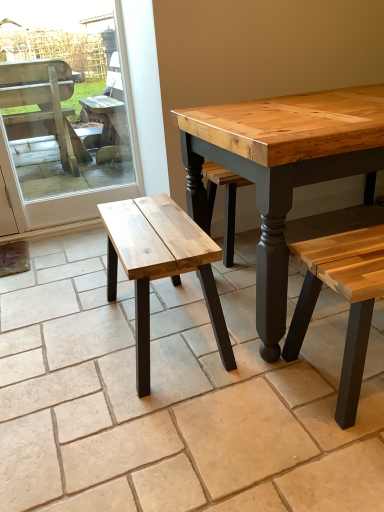
Question: From their relative heights in the image, would you say natural wood bench at center is taller or shorter than wooden bench at left?

Choices:
 (A) tall
 (B) short

Answer: (B)

Question: Do you think natural wood bench at center is within wooden bench at left, or outside of it?

Choices:
 (A) inside
 (B) outside

Answer: (B)

Question: Looking at their shapes, would you say natural wood bench at center is wider or thinner than wooden bench at left?

Choices:
 (A) thin
 (B) wide

Answer: (B)

Question: In the image, is wooden bench at left positioned in front of or behind natural wood bench at center?

Choices:
 (A) behind
 (B) front

Answer: (A)

Question: Would you say wooden bench at left is inside or outside natural wood bench at center?

Choices:
 (A) inside
 (B) outside

Answer: (B)

Question: Visually, is wooden bench at left positioned to the left or to the right of natural wood bench at center?

Choices:
 (A) right
 (B) left

Answer: (B)

Question: Looking at their shapes, would you say wooden bench at left is wider or thinner than natural wood bench at center?

Choices:
 (A) wide
 (B) thin

Answer: (B)